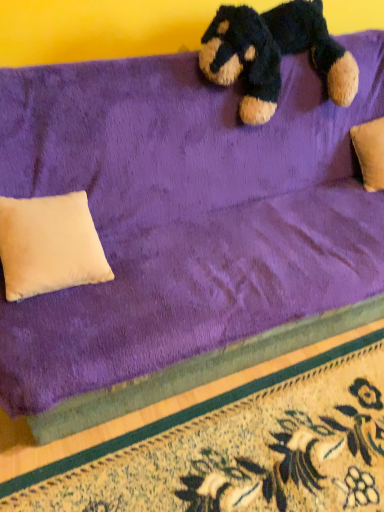
At what (x,y) coordinates should I click in order to perform the action: click on free spot above floral carpet at lower right (from a real-world perspective). Please return your answer as a coordinate pair (x, y). Looking at the image, I should click on (260, 438).